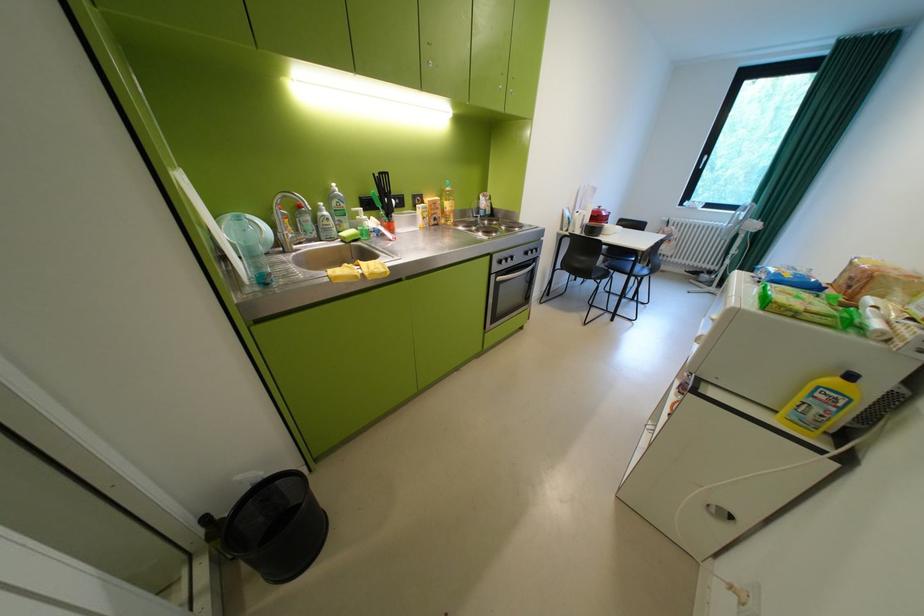
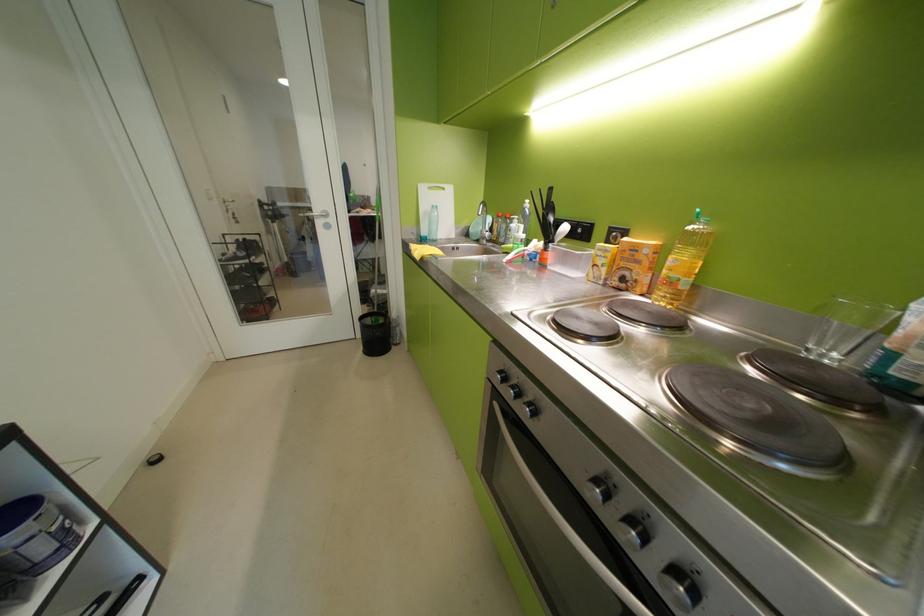
Question: I am providing you with two images of the same scene from different viewpoints. Please identify which objects are invisible in image2.

Choices:
 (A) whiteboard eraser tray
 (B) green soap bottle
 (C) silver oven handle
 (D) yellow oil bottle

Answer: (B)